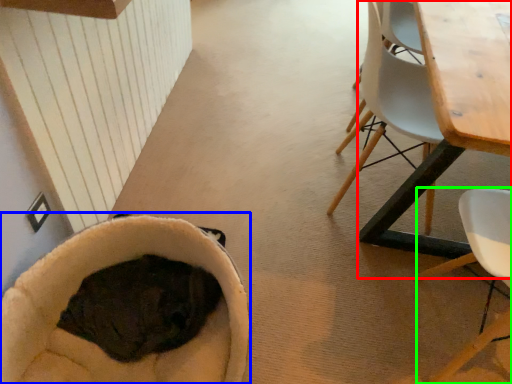
Question: Based on their relative distances, which object is farther from table (highlighted by a red box)? Choose from bean bag chair (highlighted by a blue box) and chair (highlighted by a green box).

Choices:
 (A) bean bag chair
 (B) chair

Answer: (A)